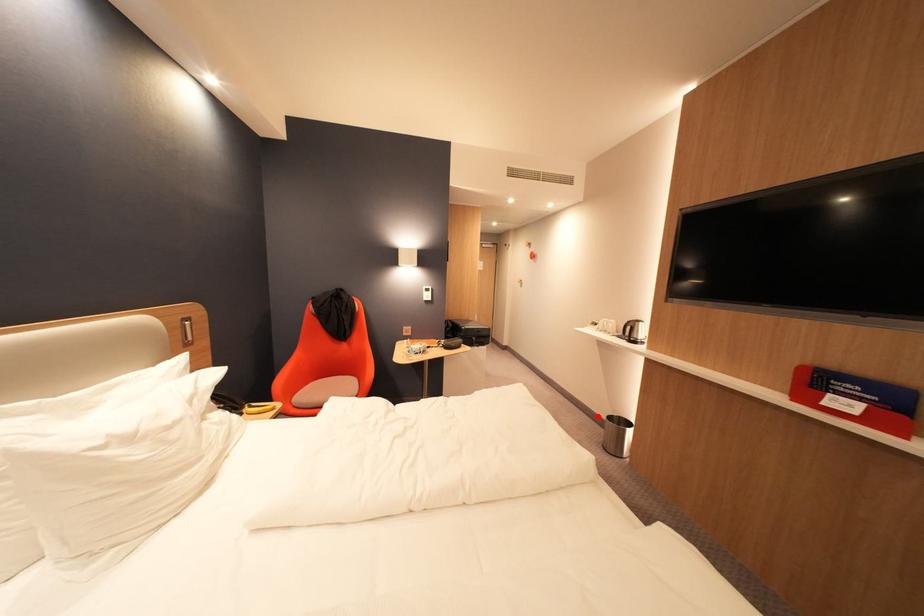
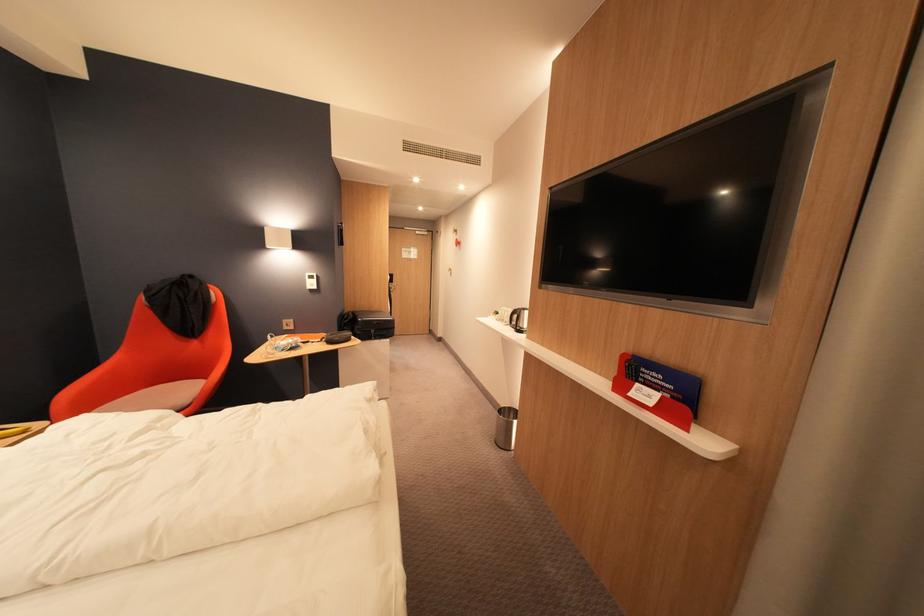
Question: I am providing you with two images of the same scene from different viewpoints. In image1, a red point is highlighted. Considering the same 3D point in image2, which of the following is correct?

Choices:
 (A) It is closer
 (B) It is farther

Answer: (A)